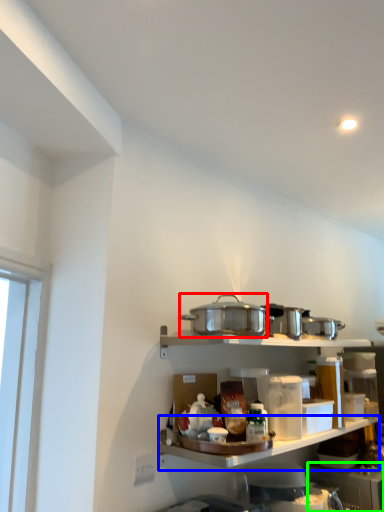
Question: Which is farther away from appliance (highlighted by a red box)? shelf (highlighted by a blue box) or appliance (highlighted by a green box)?

Choices:
 (A) shelf
 (B) appliance

Answer: (B)